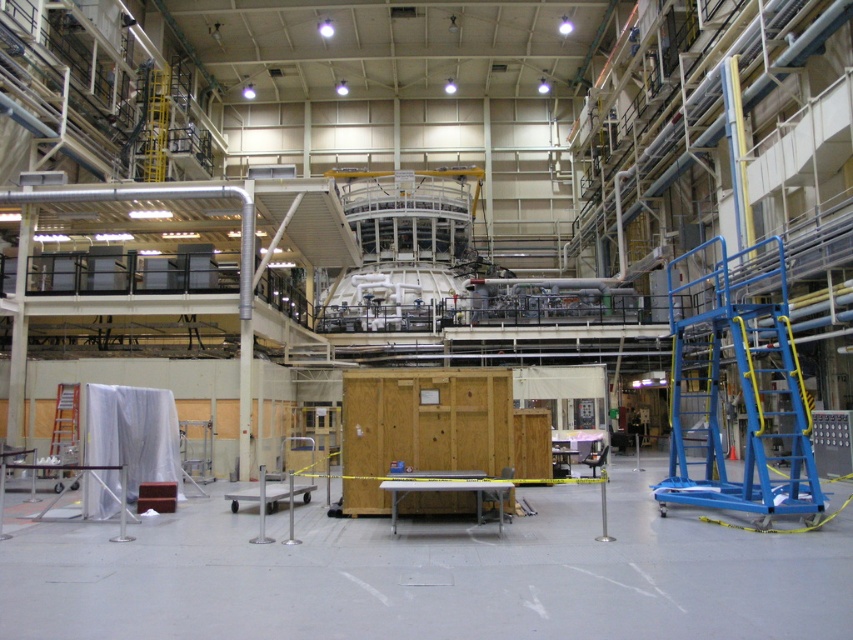
Which of these two, blue metallic platform at right or metallic gray table at center, stands taller?

blue metallic platform at right

How much distance is there between blue metallic platform at right and metallic gray table at center?

They are 6.86 meters apart.

Based on the photo, who is more forward, (x=714, y=355) or (x=450, y=481)?

Point (x=450, y=481) is more forward.

At what (x,y) coordinates should I click in order to perform the action: click on blue metallic platform at right. Please return your answer as a coordinate pair (x, y). Looking at the image, I should click on pos(737,385).

Does metallic gray table at center appear on the right side of silver metallic ladder at left?

Correct, you'll find metallic gray table at center to the right of silver metallic ladder at left.

Is metallic gray table at center thinner than silver metallic ladder at left?

In fact, metallic gray table at center might be wider than silver metallic ladder at left.

The width and height of the screenshot is (853, 640). Find the location of `metallic gray table at center`. metallic gray table at center is located at coordinates (445, 486).

Locate an element on the screen. metallic gray table at center is located at coordinates click(445, 486).

Who is taller, blue metallic platform at right or silver metallic ladder at left?

blue metallic platform at right

Does blue metallic platform at right have a greater height compared to silver metallic ladder at left?

Correct, blue metallic platform at right is much taller as silver metallic ladder at left.

Locate an element on the screen. blue metallic platform at right is located at coordinates (737, 385).

Find the location of `blue metallic platform at right`. blue metallic platform at right is located at coordinates (737, 385).